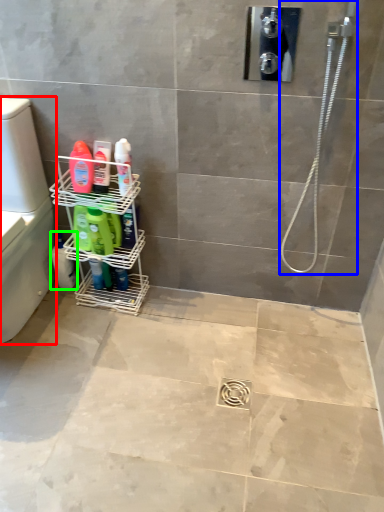
Question: Based on their relative distances, which object is farther from washer (highlighted by a red box)? Choose from shower (highlighted by a blue box) and cleaning product (highlighted by a green box).

Choices:
 (A) shower
 (B) cleaning product

Answer: (A)